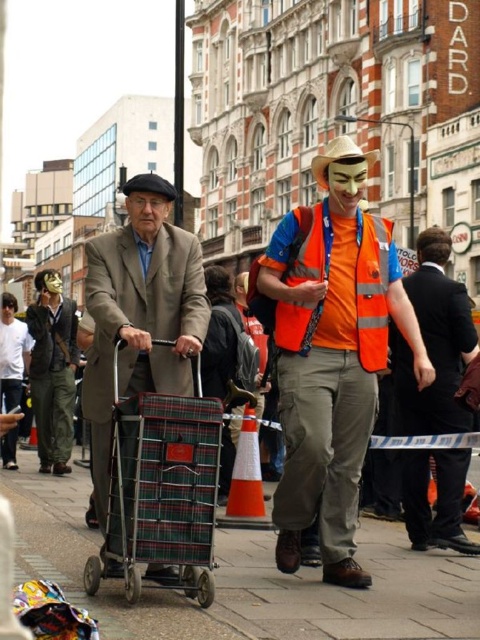
You are a delivery person trying to navigate through the street scene. There is a plaid fabric trolley at center. Where exactly is the plaid fabric trolley located in terms of coordinates?

The plaid fabric trolley at center is located at point coordinates of [162,490].

You are standing at the center of the image and want to know the position of the reflective orange vest at center. What are its coordinates?

The reflective orange vest at center is located at point (332, 365).